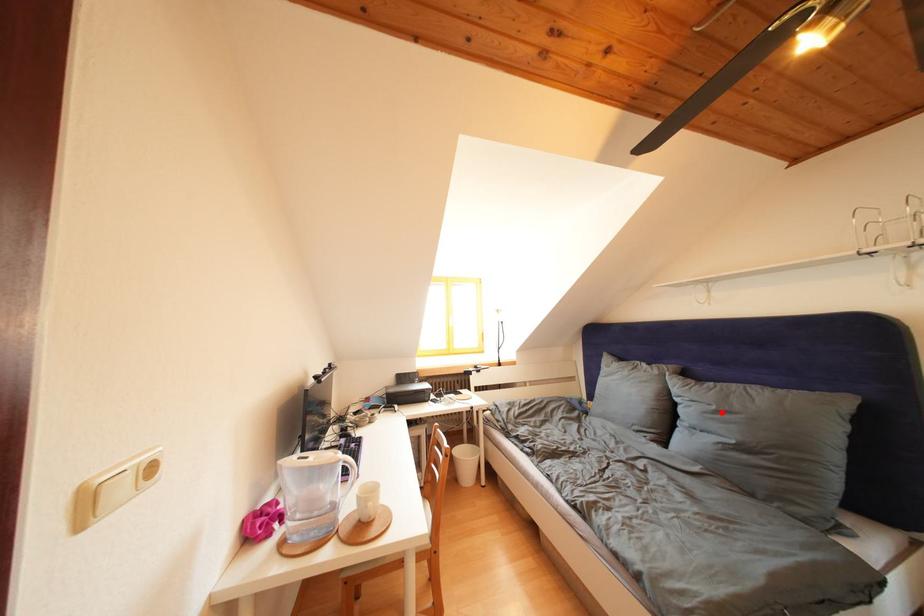
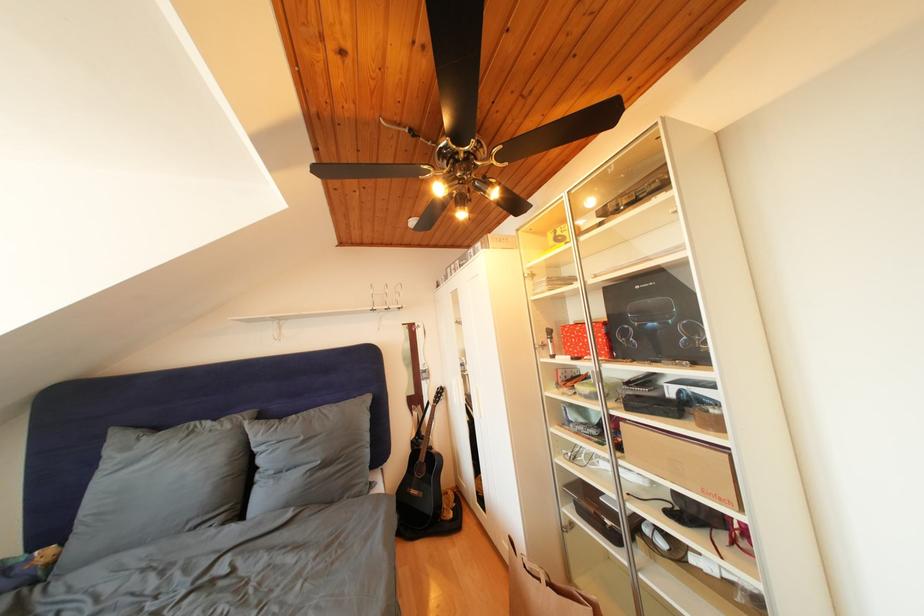
Where in the second image is the point corresponding to the highlighted location from the first image?

(310, 444)